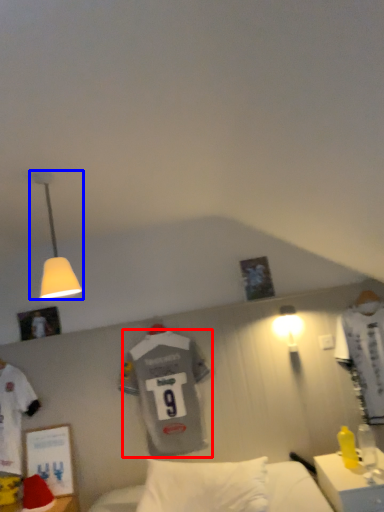
Question: Which of the following is the closest to the observer, t shirt (highlighted by a red box) or lamp (highlighted by a blue box)?

Choices:
 (A) t shirt
 (B) lamp

Answer: (B)